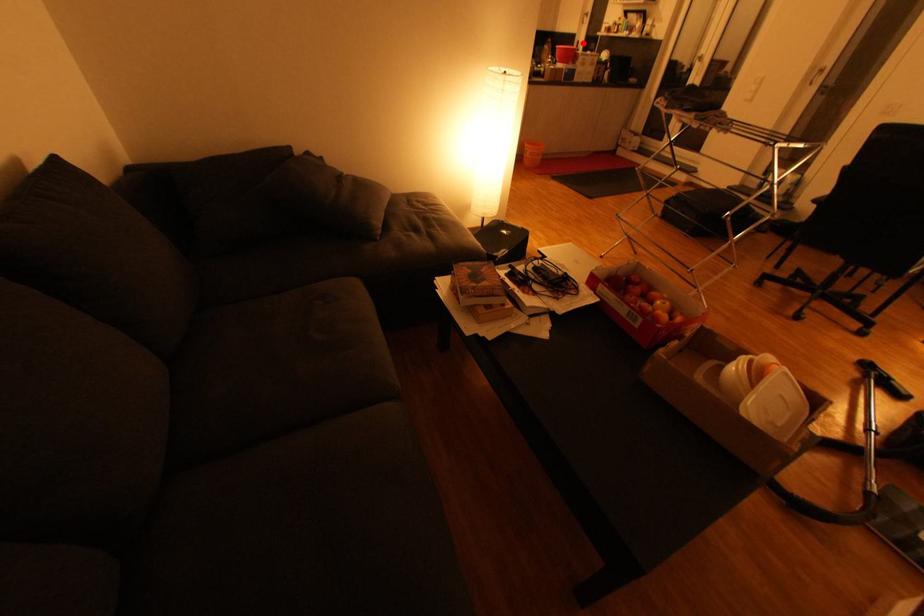
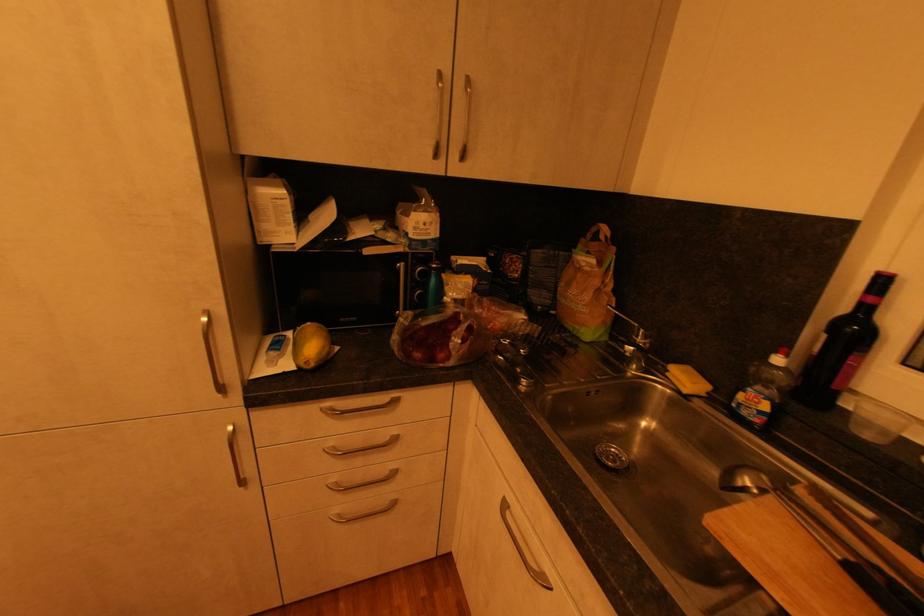
In the second image, find the point that corresponds to the highlighted location in the first image.

(889, 282)